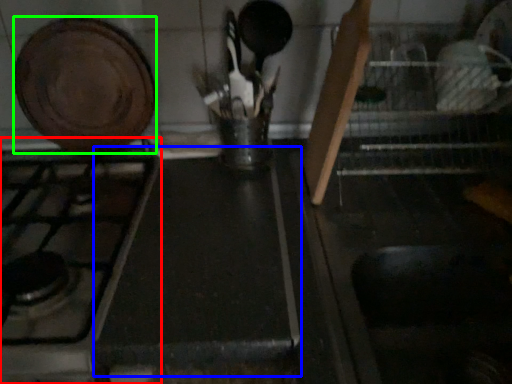
Question: Based on their relative distances, which object is farther from gas stove (highlighted by a red box)? Choose from counter top (highlighted by a blue box) and kitchen appliance (highlighted by a green box).

Choices:
 (A) counter top
 (B) kitchen appliance

Answer: (B)